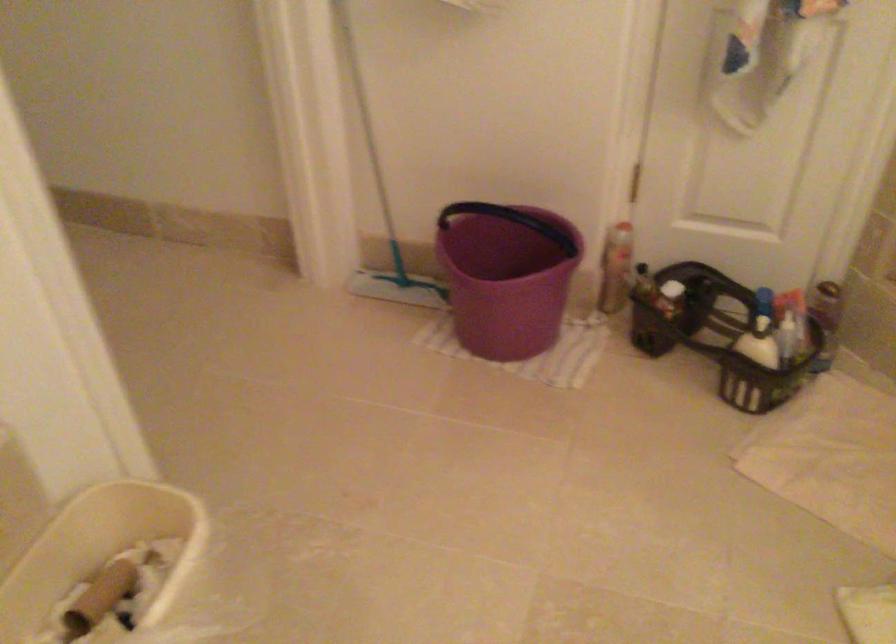
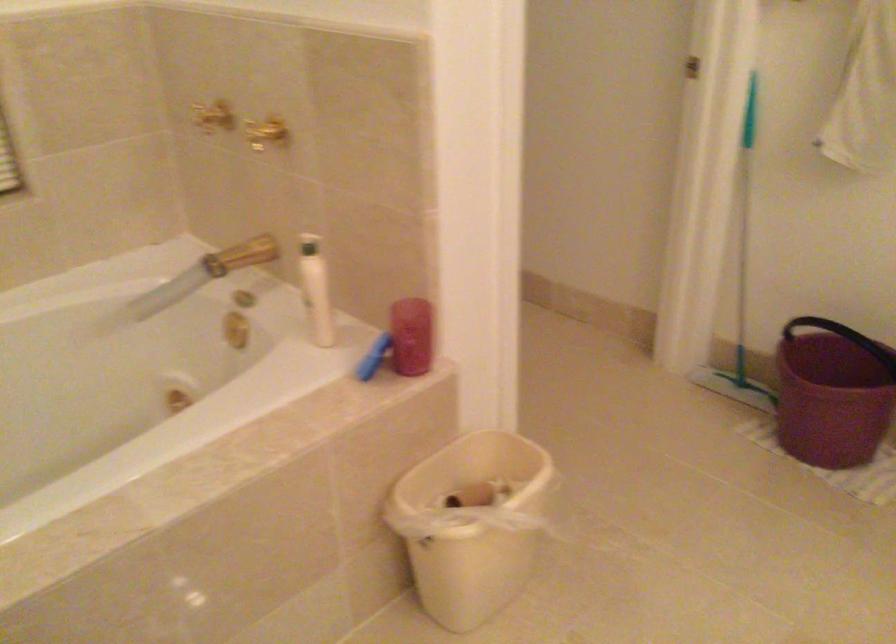
The point at (376, 169) is marked in the first image. Where is the corresponding point in the second image?

(742, 279)